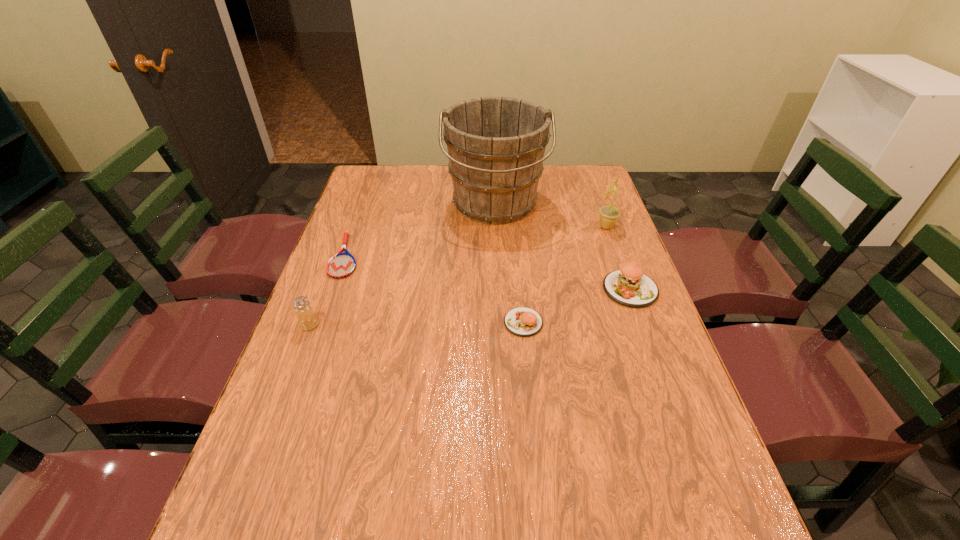
The image size is (960, 540). Find the location of `the shorter patty`. the shorter patty is located at coordinates (521, 321).

Identify the location of the left patty. (521, 321).

The height and width of the screenshot is (540, 960). In order to click on the fourth tallest object in this screenshot , I will do `click(628, 286)`.

The height and width of the screenshot is (540, 960). Identify the location of the right patty. (628, 286).

Identify the location of bucket. The height and width of the screenshot is (540, 960). (496, 145).

Find the location of a particular element. This screenshot has height=540, width=960. the second tallest object is located at coordinates (609, 215).

Find the location of a particular element. The width and height of the screenshot is (960, 540). saltshaker is located at coordinates (307, 320).

Where is `tennis racket`? The width and height of the screenshot is (960, 540). tennis racket is located at coordinates coord(341,265).

You are a GUI agent. You are given a task and a screenshot of the screen. Output one action in this format:
    pyautogui.click(x=<x>, y=<y>)
    Task: Click on the vacant space positioned 0.180m on the front of the shorter patty
    The height and width of the screenshot is (540, 960).
    Given the screenshot: What is the action you would take?
    pyautogui.click(x=531, y=401)

Identify the location of free location located 0.360m on the front of the taller patty. (684, 436).